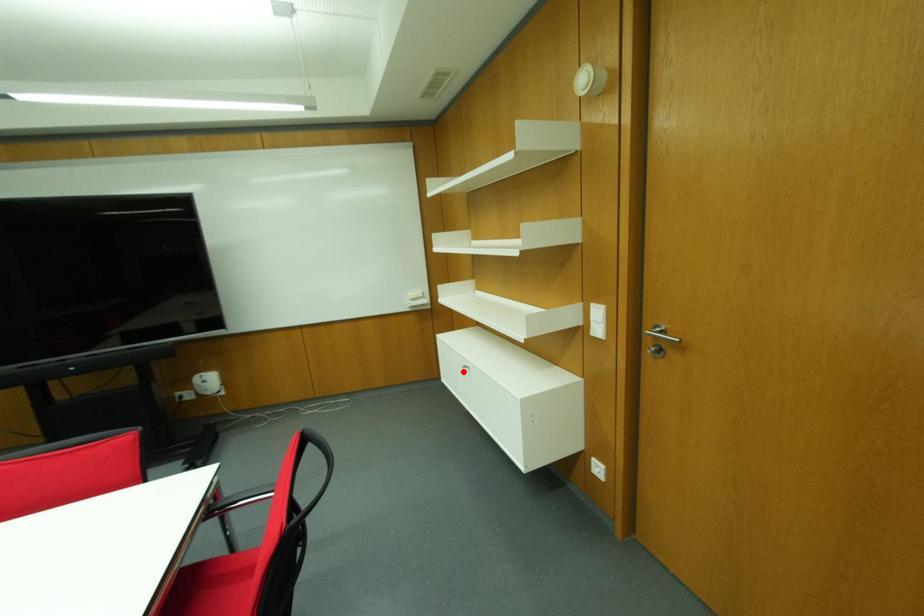
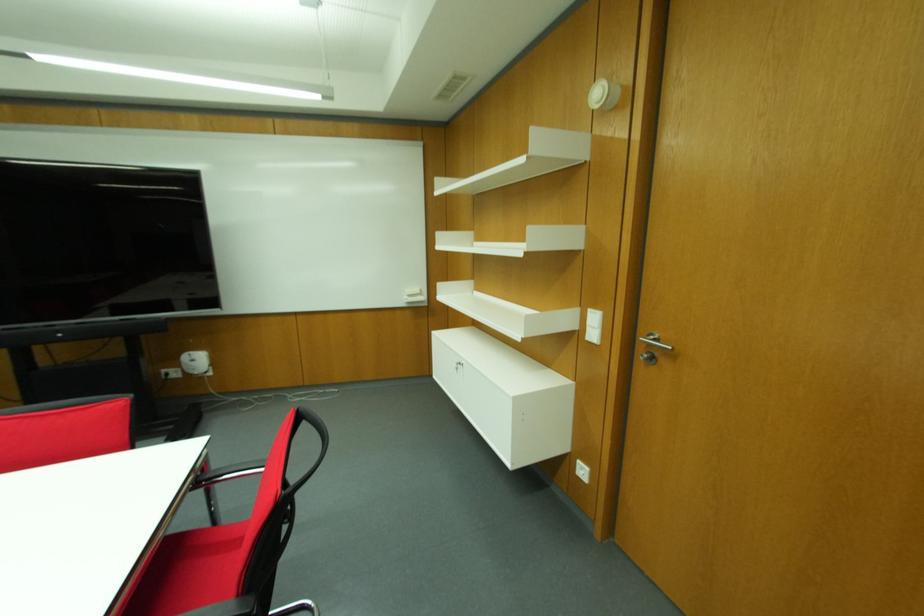
Find the pixel in the second image that matches the highlighted location in the first image.

(456, 369)